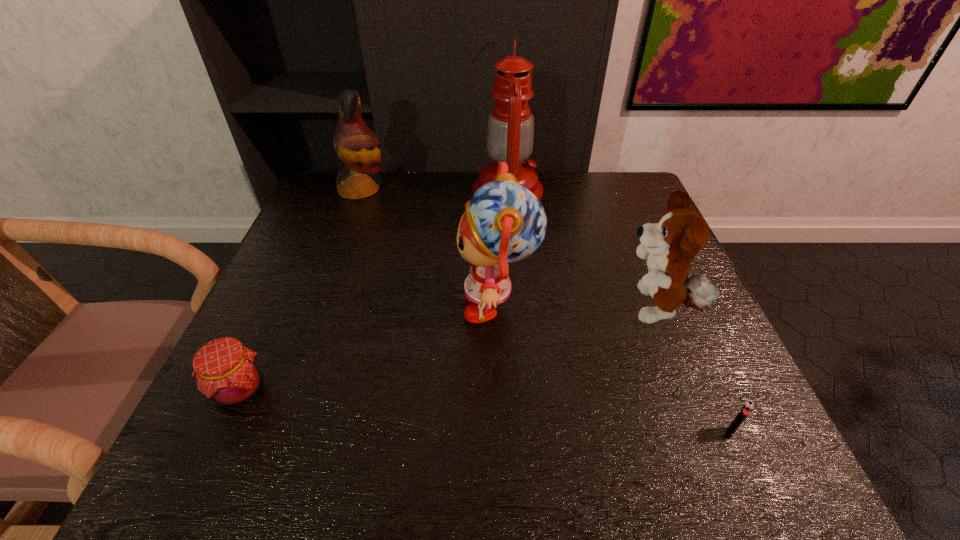
Where is `object positioned at the near edge`? object positioned at the near edge is located at coordinates (748, 406).

Where is `parrot located at the left edge`? Image resolution: width=960 pixels, height=540 pixels. parrot located at the left edge is located at coordinates (356, 145).

At what (x,y) coordinates should I click in order to perform the action: click on jam that is at the left edge. Please return your answer as a coordinate pair (x, y). Image resolution: width=960 pixels, height=540 pixels. Looking at the image, I should click on (226, 371).

Locate an element on the screen. This screenshot has width=960, height=540. puppy that is at the right edge is located at coordinates (668, 246).

Where is `igniter that is positioned at the right edge`? This screenshot has height=540, width=960. igniter that is positioned at the right edge is located at coordinates (748, 406).

The image size is (960, 540). Identify the location of object situated at the far left corner. pyautogui.click(x=356, y=145).

Find the location of a particular element. object that is at the near right corner is located at coordinates (748, 406).

At what (x,y) coordinates should I click in order to perform the action: click on free space at the far edge. Please return your answer as a coordinate pair (x, y). Looking at the image, I should click on (404, 176).

Identify the location of free region at the near edge of the desktop. (576, 457).

You are a GUI agent. You are given a task and a screenshot of the screen. Output one action in this format:
    pyautogui.click(x=<x>, y=<y>)
    Task: Click on the free space at the left edge of the desktop
    This screenshot has height=540, width=960.
    Given the screenshot: What is the action you would take?
    pyautogui.click(x=305, y=282)